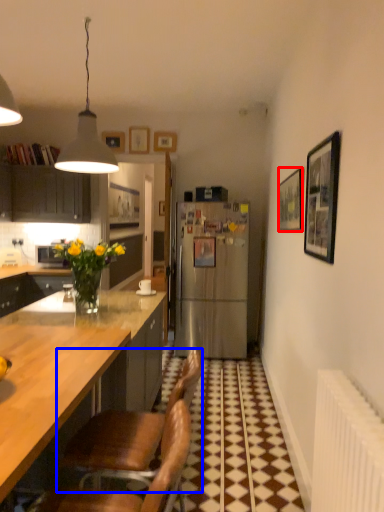
Question: Which point is closer to the camera, picture frame (highlighted by a red box) or chair (highlighted by a blue box)?

Choices:
 (A) picture frame
 (B) chair

Answer: (B)